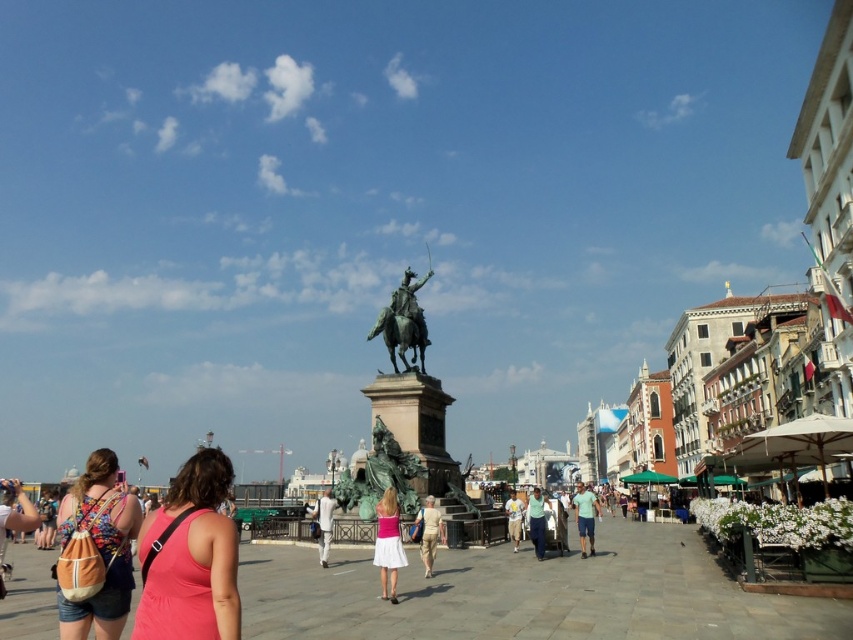
Question: Estimate the real-world distances between objects in this image. Which object is closer to the white cotton shirt at center?

Choices:
 (A) green patina statue at center
 (B) green fabric shirt at center
 (C) green fabric dress at center
 (D) green patinated bronze statue at center

Answer: (D)

Question: From the image, what is the correct spatial relationship of matte orange backpack at lower left in relation to bronze statue at center?

Choices:
 (A) above
 (B) below

Answer: (B)

Question: Considering the relative positions of green patina statue at center and matte orange backpack at lower left in the image provided, where is green patina statue at center located with respect to matte orange backpack at lower left?

Choices:
 (A) above
 (B) below

Answer: (A)

Question: Does matte orange backpack at lower left appear on the right side of green patinated bronze statue at center?

Choices:
 (A) no
 (B) yes

Answer: (A)

Question: Which point is farther to the camera?

Choices:
 (A) green patina statue at center
 (B) light beige cotton shirt at center
 (C) matte orange backpack at lower left
 (D) pink satin dress at center

Answer: (A)

Question: Which of the following is the closest to the observer?

Choices:
 (A) (538, 518)
 (B) (436, 435)
 (C) (79, 608)

Answer: (C)